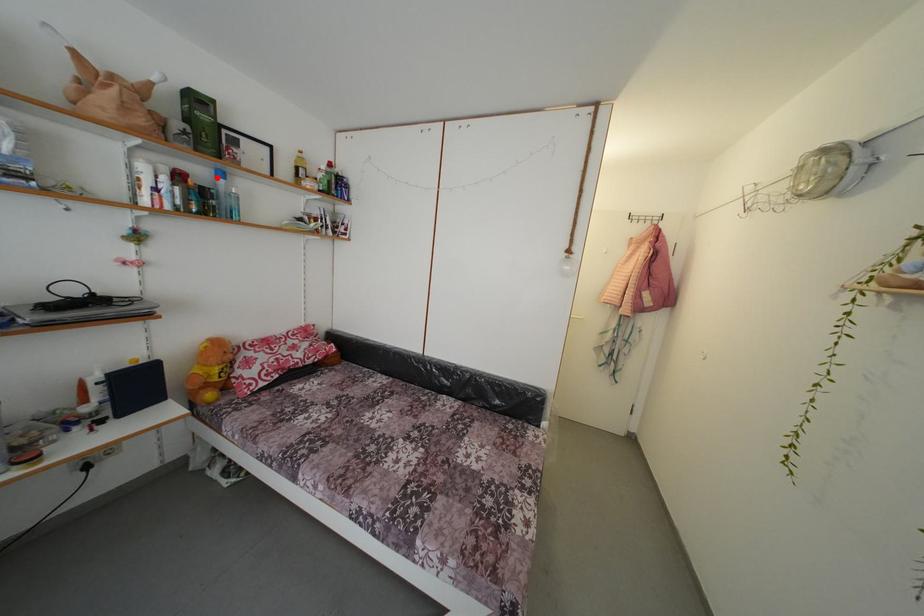
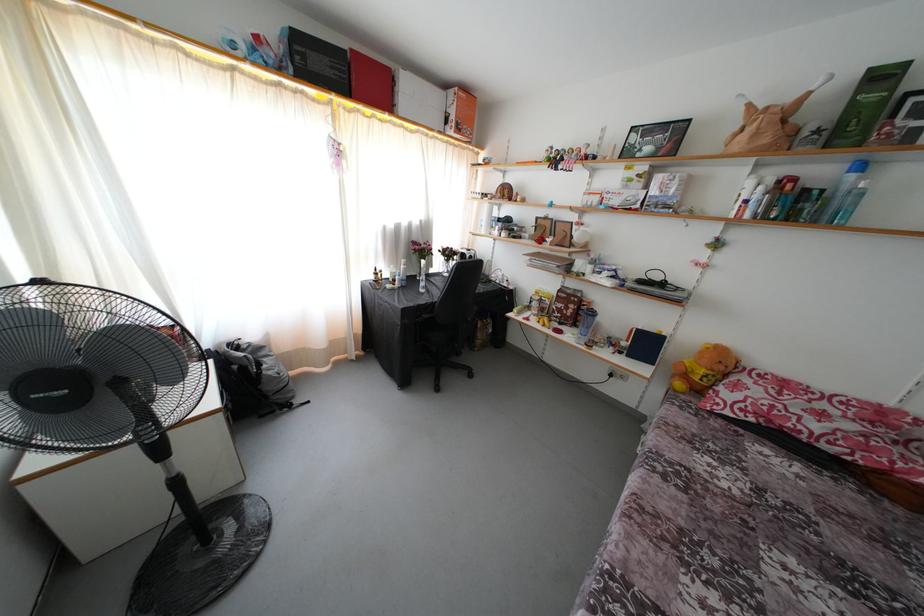
In the second image, find the point that corresponds to the highlighted location in the first image.

(849, 172)